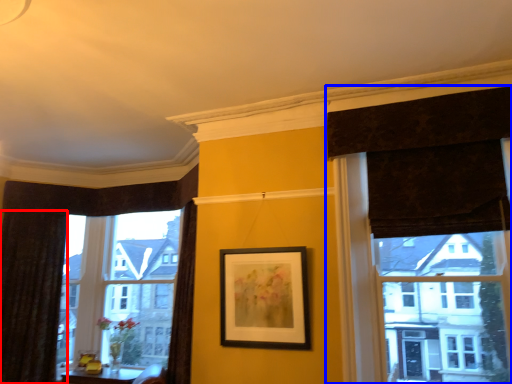
Question: Which object is closer to the camera taking this photo, curtain (highlighted by a red box) or curtain (highlighted by a blue box)?

Choices:
 (A) curtain
 (B) curtain

Answer: (B)